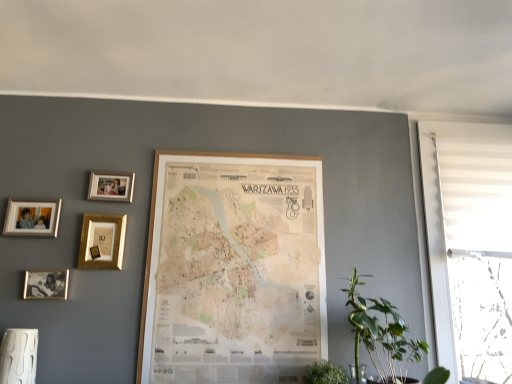
Question: Considering the relative sizes of green leafy plant at lower right and white fabric window at right in the image provided, is green leafy plant at lower right smaller than white fabric window at right?

Choices:
 (A) yes
 (B) no

Answer: (A)

Question: Is green leafy plant at lower right oriented away from white fabric window at right?

Choices:
 (A) yes
 (B) no

Answer: (B)

Question: Is green leafy plant at lower right outside of white fabric window at right?

Choices:
 (A) yes
 (B) no

Answer: (A)

Question: From a real-world perspective, is green leafy plant at lower right physically above white fabric window at right?

Choices:
 (A) yes
 (B) no

Answer: (B)

Question: From the image's perspective, is green leafy plant at lower right located above white fabric window at right?

Choices:
 (A) no
 (B) yes

Answer: (A)

Question: Does point (330, 367) appear closer or farther from the camera than point (470, 157)?

Choices:
 (A) closer
 (B) farther

Answer: (A)

Question: Looking at the image, does green leafy plant at lower center, the first houseplant positioned from the left, seem bigger or smaller compared to white fabric window at right?

Choices:
 (A) big
 (B) small

Answer: (B)

Question: Is green leafy plant at lower center, which is the 2th houseplant from right to left, inside or outside of white fabric window at right?

Choices:
 (A) inside
 (B) outside

Answer: (B)

Question: Relative to white fabric window at right, is green leafy plant at lower center, which is the 2th houseplant from right to left, in front or behind?

Choices:
 (A) behind
 (B) front

Answer: (B)

Question: In terms of size, does wooden map at center, which is the 1th picture frame from right to left, appear bigger or smaller than silver metallic photo frame at upper left, arranged as the 1th picture frame when viewed from the left?

Choices:
 (A) big
 (B) small

Answer: (A)

Question: Based on their positions, is wooden map at center, which is the 1th picture frame from right to left, located to the left or right of silver metallic photo frame at upper left, arranged as the 1th picture frame when viewed from the left?

Choices:
 (A) left
 (B) right

Answer: (B)

Question: From a real-world perspective, is wooden map at center, which is the fifth picture frame from left to right, positioned above or below silver metallic photo frame at upper left, the 5th picture frame when ordered from right to left?

Choices:
 (A) above
 (B) below

Answer: (B)

Question: In terms of width, does wooden map at center, which is the 1th picture frame from right to left, look wider or thinner when compared to silver metallic photo frame at upper left, the 5th picture frame when ordered from right to left?

Choices:
 (A) thin
 (B) wide

Answer: (A)

Question: Considering the positions of point (42, 216) and point (313, 374), is point (42, 216) closer or farther from the camera than point (313, 374)?

Choices:
 (A) closer
 (B) farther

Answer: (B)

Question: From a real-world perspective, is silver metallic photo frame at upper left, arranged as the 1th picture frame when viewed from the left, physically located above or below green leafy plant at lower center, which is the 2th houseplant from right to left?

Choices:
 (A) below
 (B) above

Answer: (B)